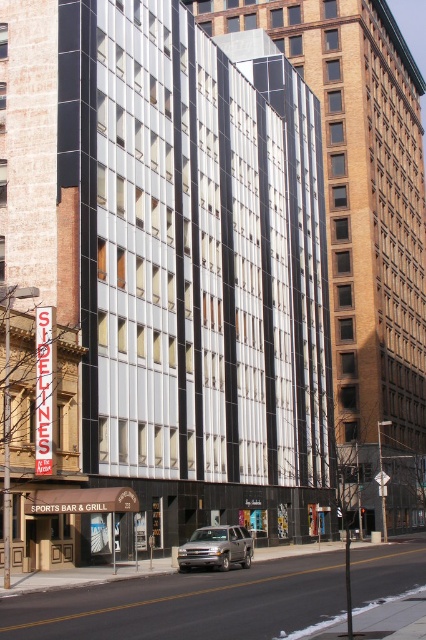
You are a delivery person who needs to park your vehicle in the parking lot behind the glassy reflective building at center. The parking lot has height restrictions of 2 meters. Given that the silver metallic suv at center is 1.8 meters tall, can you safely park your vehicle there?

The silver metallic suv at center is 1.8 meters tall, which is under the 2 meters height restriction. Since the glassy reflective building at center is much taller than the suv, the height restriction likely applies to all vehicles. Therefore, if your vehicle is also under 2 meters, you can safely park there.

You are standing on the sidewalk in front of the sports bar and grill. You want to take a photo of the glassy reflective building at center without the silver metallic suv at center blocking the view. Is the suv closer to you or farther away than the building?

The glassy reflective building at center is further to the viewer than the silver metallic suv at center, so the suv is closer to you than the building. To take a photo without the suv blocking the view, you might need to move to a different angle or position where the suv is not between you and the building.